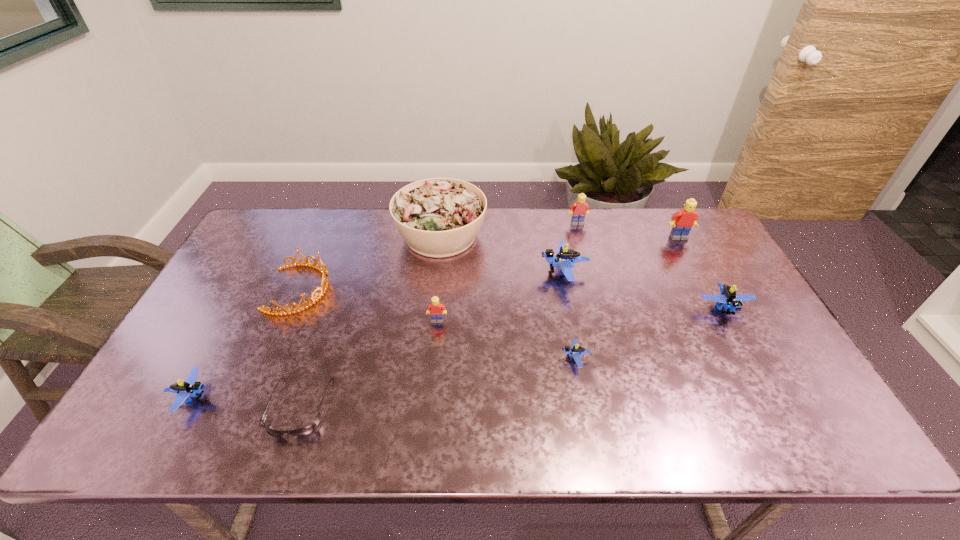
Image resolution: width=960 pixels, height=540 pixels. Find the location of `the sixth tallest Lego`. the sixth tallest Lego is located at coordinates (190, 388).

Where is `the nearest blue Lego`? This screenshot has width=960, height=540. the nearest blue Lego is located at coordinates (190, 388).

Find the location of a particular element. The image size is (960, 540). the second shortest object is located at coordinates (576, 352).

Where is `the smallest blue Lego`? This screenshot has width=960, height=540. the smallest blue Lego is located at coordinates (576, 352).

Image resolution: width=960 pixels, height=540 pixels. I want to click on the shortest object, so click(x=307, y=430).

What are the coordinates of `vacant space located 0.330m on the front of the salad` in the screenshot? It's located at (429, 349).

Locate an element on the screen. vacant space located 0.260m on the front-facing side of the biggest yellow Lego is located at coordinates pos(709,295).

You are a GUI agent. You are given a task and a screenshot of the screen. Output one action in this format:
    pyautogui.click(x=<x>, y=<y>)
    Task: Click on the free space located on the front-facing side of the second biggest yellow Lego
    
    Given the screenshot: What is the action you would take?
    (x=585, y=249)

Find the location of a particular element. The height and width of the screenshot is (540, 960). vacant space located 0.170m on the front-facing side of the biggest blue Lego is located at coordinates (485, 273).

Where is `vacant region located 0.060m on the front-facing side of the biggest blue Lego`? This screenshot has height=540, width=960. vacant region located 0.060m on the front-facing side of the biggest blue Lego is located at coordinates (520, 273).